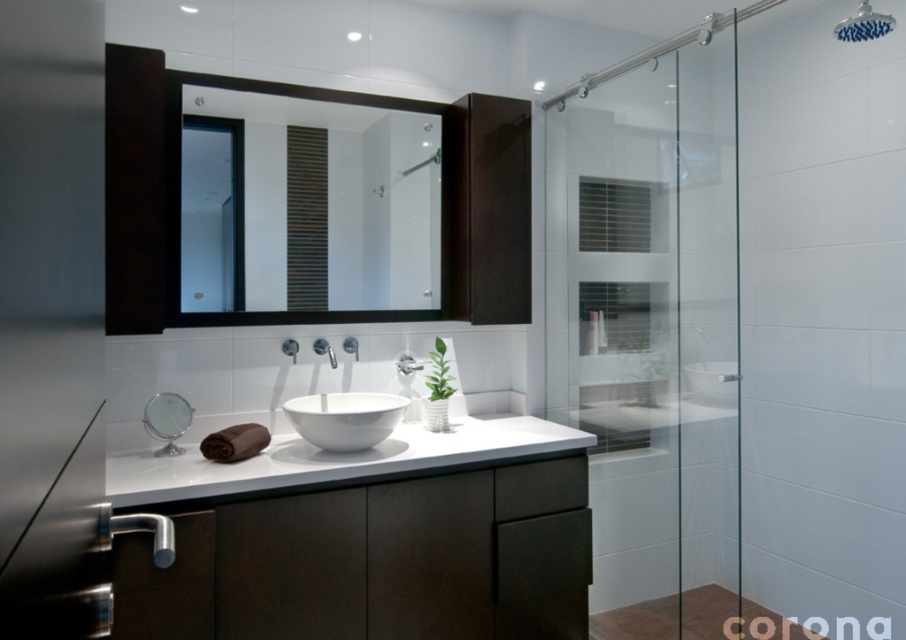
You are a home inspector checking the bathroom layout. You notice the transparent glass shower door at right and the white glossy faucet at center. According to the building code, the shower door must be positioned so that it doesn not obstruct the faucet when fully opened. Can you determine if this bathroom complies with the requirement?

The transparent glass shower door at right is located above the white glossy faucet at center, so when opened fully, the shower door would not block the faucet. Therefore, the bathroom complies with the building code requirement.

You are a plumber inspecting the bathroom fixtures. You see the white glossy faucet at center and the matte silver faucet at center. Which one is positioned to the right?

The white glossy faucet at center is positioned to the right of the matte silver faucet at center.